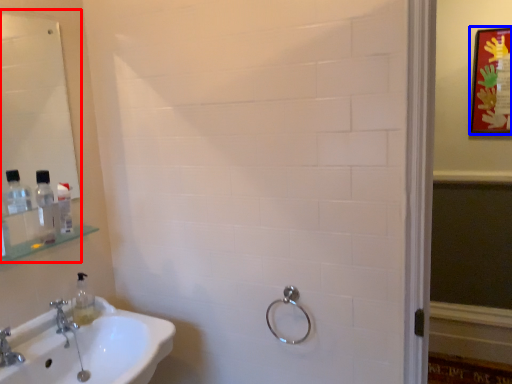
Question: Which of the following is the closest to the observer, mirror (highlighted by a red box) or picture frame (highlighted by a blue box)?

Choices:
 (A) mirror
 (B) picture frame

Answer: (A)